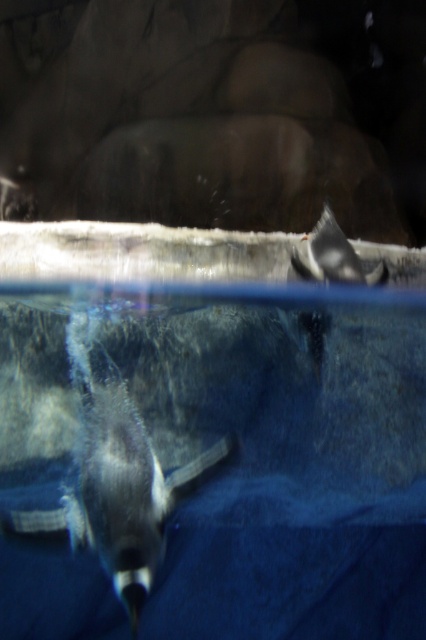
You are an aquatic animal trainer observing two penguins in an aquarium. You need to determine which penguin has a greater width. The penguins are the shiny black penguin at lower left and the white matte penguin at upper right. Can you identify which one is wider?

The shiny black penguin at lower left is wider than the white matte penguin at upper right according to the description provided.

You are a visitor at the aquarium and want to take a photo of both the shiny black penguin at lower left and the white matte penguin at upper right. Which penguin should you focus on first if you want to capture them both in the same frame without zooming in or out?

You should focus on the shiny black penguin at lower left first because it is larger in size than the white matte penguin at upper right, so adjusting the camera to include the larger penguin will naturally accommodate the smaller one in the frame.